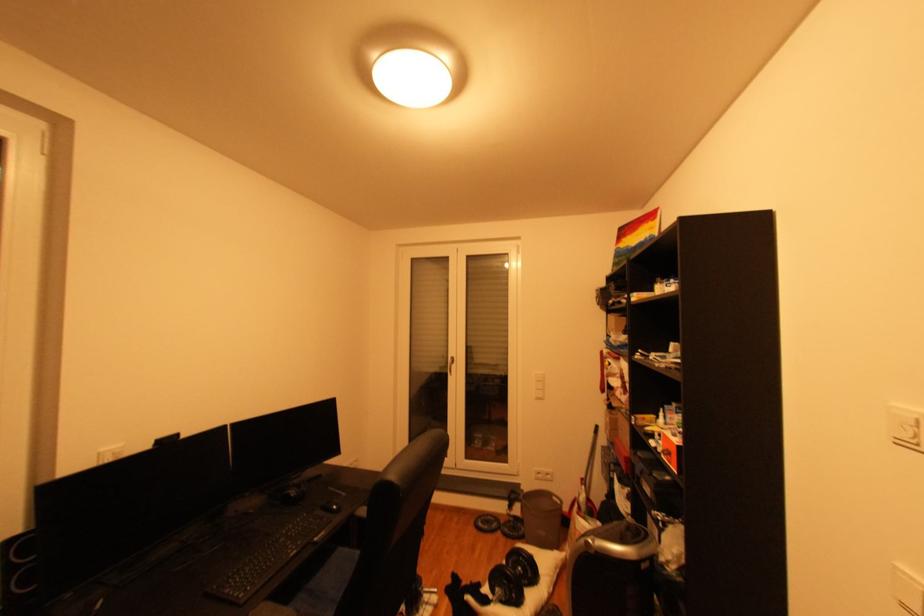
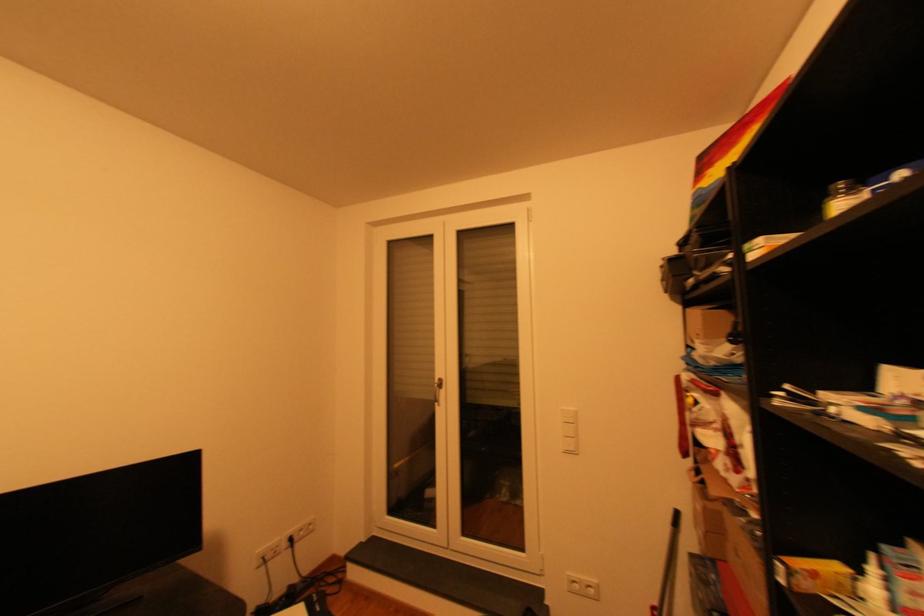
Find the pixel in the second image that matches the point at 591,480 in the first image.

(662, 608)